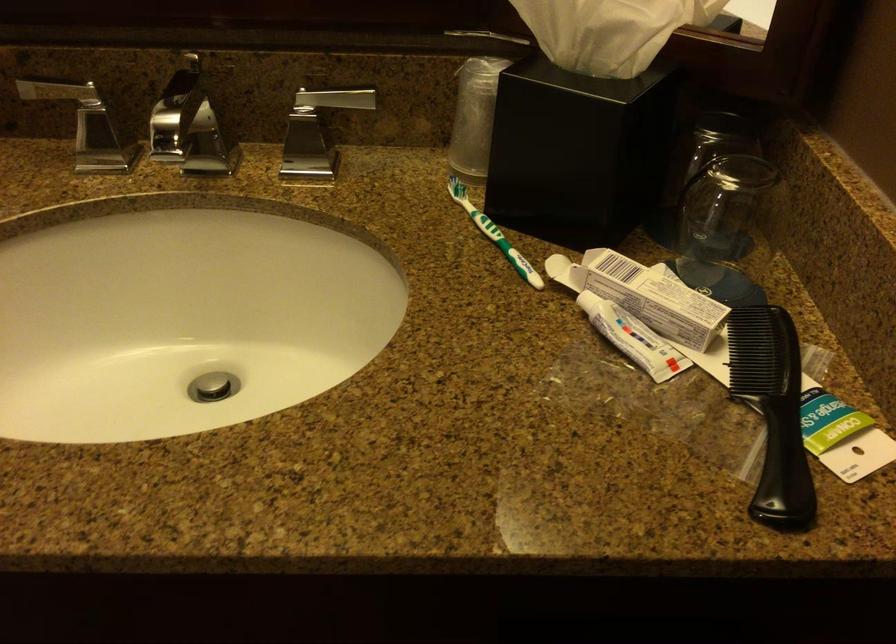
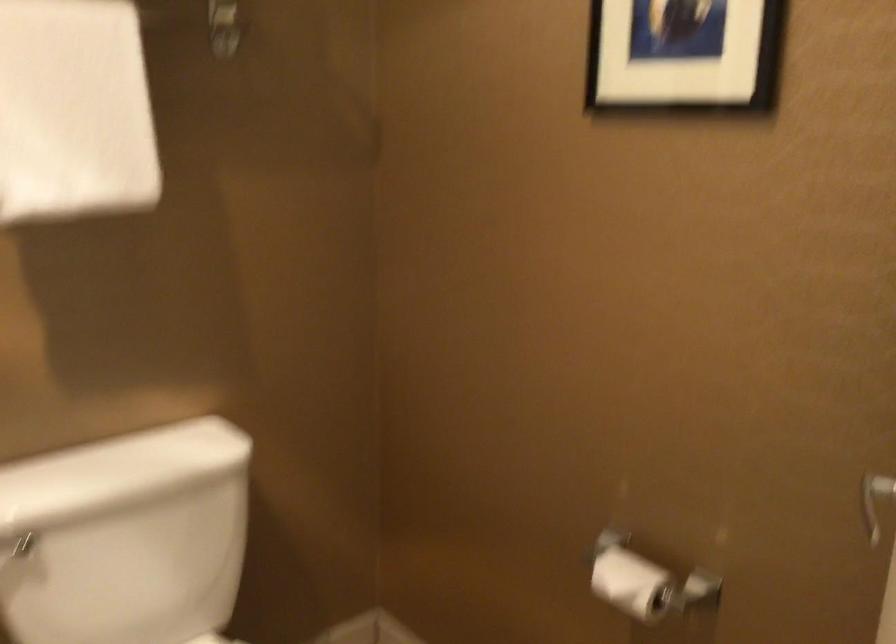
Question: The camera is either moving clockwise (left) or counter-clockwise (right) around the object. The first image is from the beginning of the video and the second image is from the end. Is the camera moving left or right when shooting the video?

Choices:
 (A) Left
 (B) Right

Answer: (B)